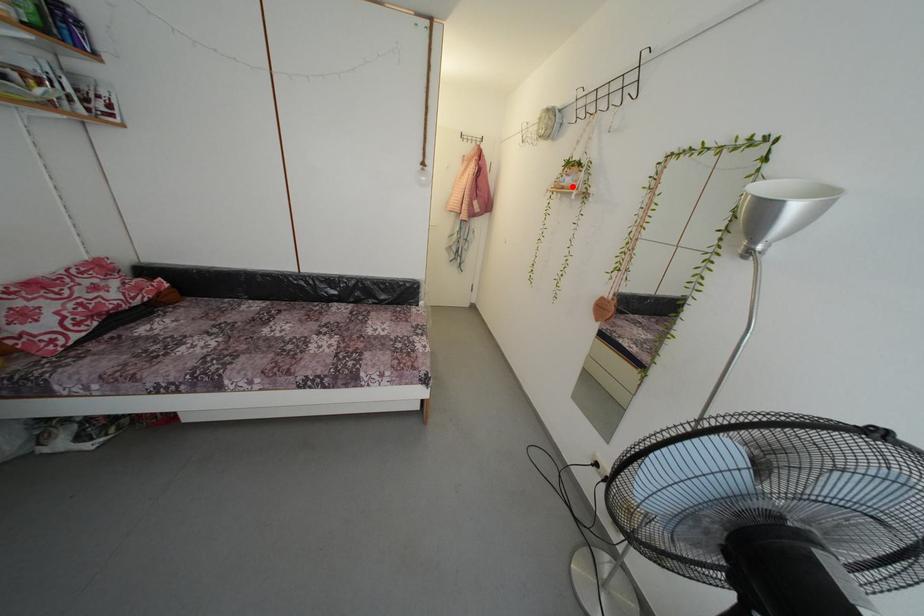
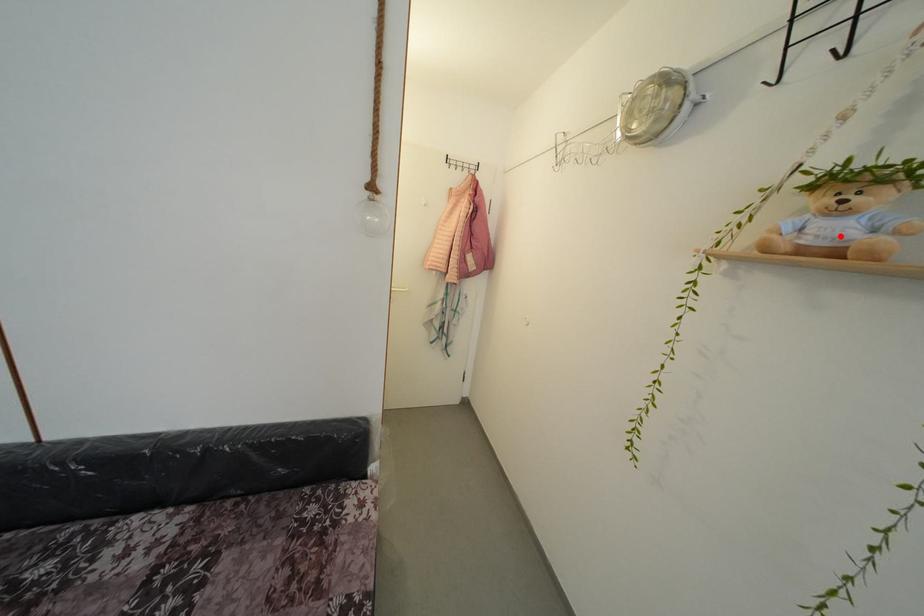
I am providing you with two images of the same scene from different viewpoints. A red point is marked on the first image and another point is marked on the second image. Does the point marked in image1 correspond to the same location as the one in image2?

Yes